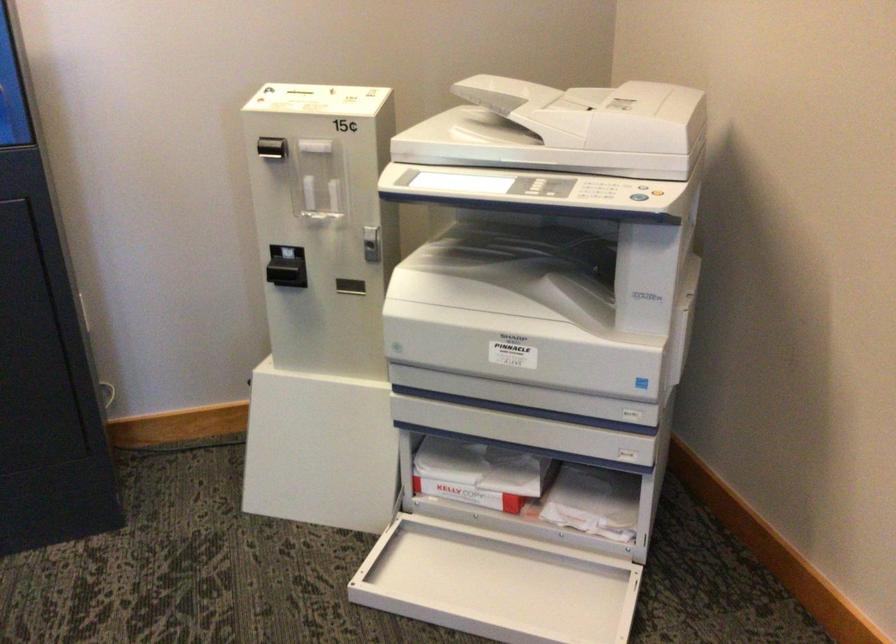
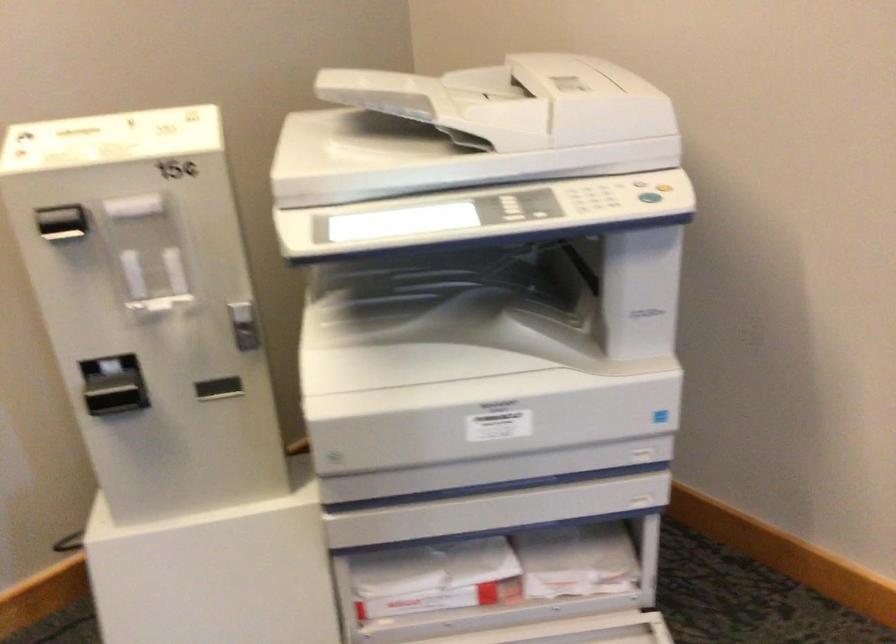
Where in the second image is the point corresponding to (x=470, y=476) from the first image?

(435, 576)